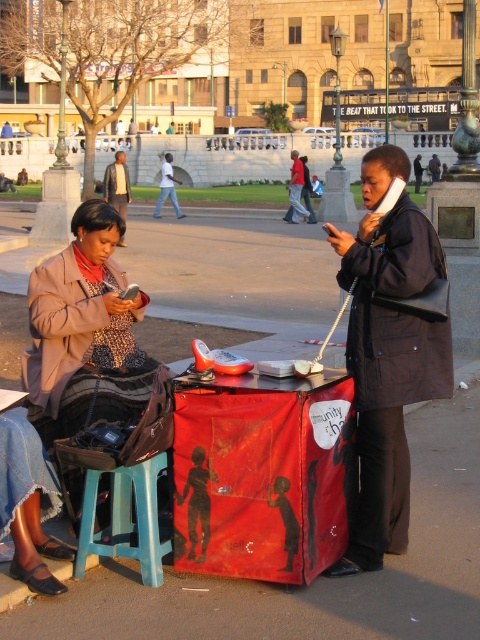
Question: Which object is positioned closest to the matte black coat at center?

Choices:
 (A) blue plastic stool at lower left
 (B) matte brown coat at left
 (C) dark brown leather jacket at center
 (D) red fabric jacket at center

Answer: (A)

Question: Does blue plastic stool at lower left lie in front of red fabric jacket at center?

Choices:
 (A) no
 (B) yes

Answer: (B)

Question: Among these points, which one is farthest from the camera?

Choices:
 (A) (292, 164)
 (B) (43, 308)
 (C) (441, 248)
 (D) (84, 525)

Answer: (A)

Question: Among these points, which one is nearest to the camera?

Choices:
 (A) (444, 273)
 (B) (84, 566)

Answer: (B)

Question: Can you confirm if matte black coat at center is positioned to the left of blue plastic stool at lower left?

Choices:
 (A) no
 (B) yes

Answer: (A)

Question: From the image, what is the correct spatial relationship of matte black coat at center in relation to matte brown coat at left?

Choices:
 (A) above
 (B) below

Answer: (A)